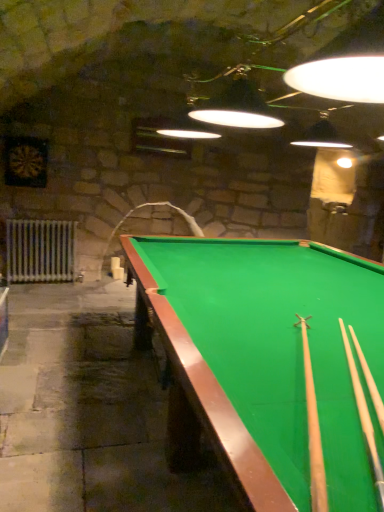
Question: From a real-world perspective, is white metallic radiator at left on top of light wood cue at right, which appears as the second cue when viewed from the left?

Choices:
 (A) yes
 (B) no

Answer: (B)

Question: Considering the relative positions of white metallic radiator at left and light wood cue at right, which appears as the 1th cue when viewed from the right, in the image provided, is white metallic radiator at left behind light wood cue at right, which appears as the 1th cue when viewed from the right,?

Choices:
 (A) yes
 (B) no

Answer: (A)

Question: Is white metallic radiator at left smaller than light wood cue at right, which appears as the second cue when viewed from the left?

Choices:
 (A) yes
 (B) no

Answer: (B)

Question: Is white metallic radiator at left not inside light wood cue at right, which appears as the second cue when viewed from the left?

Choices:
 (A) no
 (B) yes

Answer: (B)

Question: Can you confirm if white metallic radiator at left is shorter than light wood cue at right, which appears as the 1th cue when viewed from the right?

Choices:
 (A) yes
 (B) no

Answer: (B)

Question: Looking at their shapes, would you say green felt billiard table at center is wider or thinner than light wood cue at right, which appears as the 1th cue when viewed from the right?

Choices:
 (A) wide
 (B) thin

Answer: (A)

Question: From a real-world perspective, is green felt billiard table at center above or below light wood cue at right, which appears as the 1th cue when viewed from the right?

Choices:
 (A) below
 (B) above

Answer: (A)

Question: Would you say green felt billiard table at center is to the left or to the right of light wood cue at right, which appears as the 1th cue when viewed from the right, in the picture?

Choices:
 (A) left
 (B) right

Answer: (B)

Question: Looking at the image, does green felt billiard table at center seem bigger or smaller compared to light wood cue at right, which appears as the second cue when viewed from the left?

Choices:
 (A) small
 (B) big

Answer: (B)

Question: Is green felt billiard table at center spatially inside white metallic radiator at left, or outside of it?

Choices:
 (A) outside
 (B) inside

Answer: (A)

Question: In the image, is green felt billiard table at center positioned in front of or behind white metallic radiator at left?

Choices:
 (A) front
 (B) behind

Answer: (A)

Question: In the image, is green felt billiard table at center on the left side or the right side of white metallic radiator at left?

Choices:
 (A) left
 (B) right

Answer: (B)

Question: From a real-world perspective, is green felt billiard table at center positioned above or below white metallic radiator at left?

Choices:
 (A) below
 (B) above

Answer: (B)

Question: From the image's perspective, relative to green felt billiard table at center, is white metallic radiator at left above or below?

Choices:
 (A) above
 (B) below

Answer: (A)

Question: Considering their positions, is white metallic radiator at left located in front of or behind green felt billiard table at center?

Choices:
 (A) front
 (B) behind

Answer: (B)